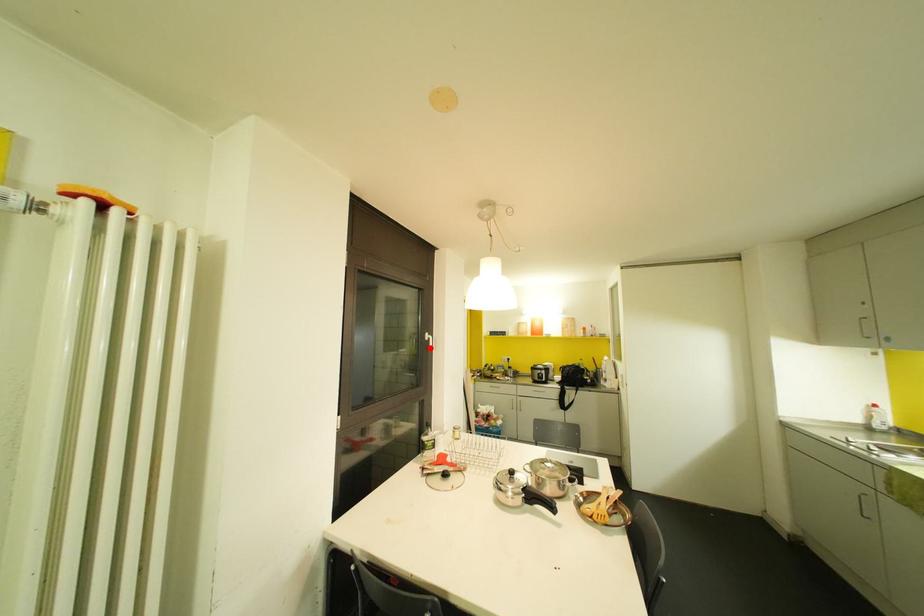
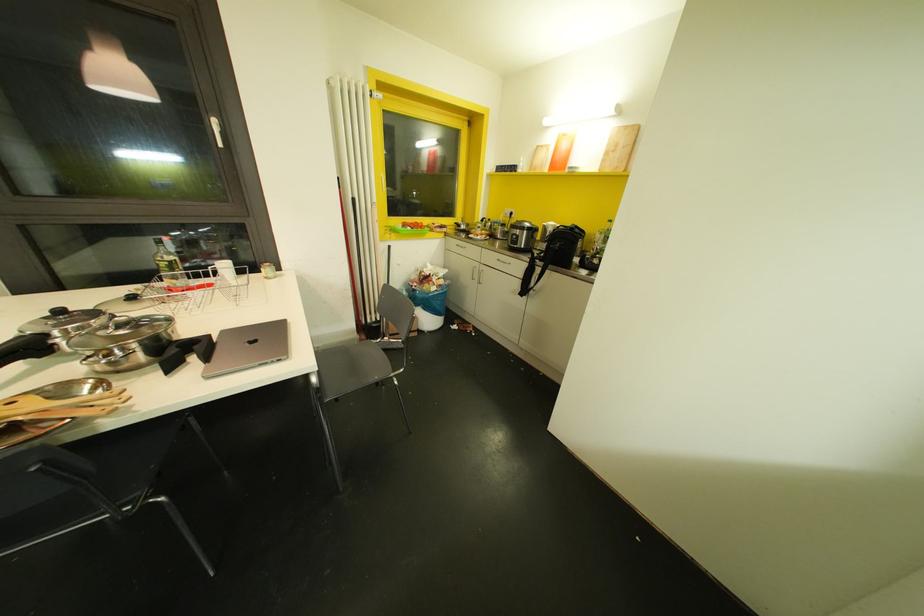
Where in the second image is the point corresponding to the highlighted location from the first image?

(220, 145)